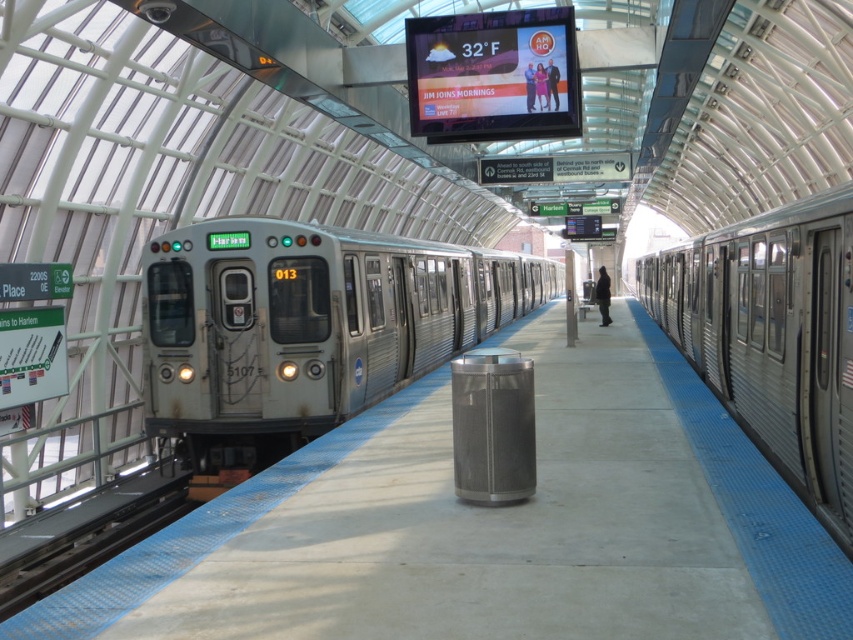
Question: Does rusty metal train at center have a lesser width compared to silver metallic train at right?

Choices:
 (A) yes
 (B) no

Answer: (B)

Question: Does rusty metal train at center have a larger size compared to silver metallic train at right?

Choices:
 (A) yes
 (B) no

Answer: (A)

Question: Which object is farther from the camera taking this photo?

Choices:
 (A) rusty metal train at center
 (B) silver metallic train at right

Answer: (A)

Question: Considering the relative positions of rusty metal train at center and silver metallic train at right in the image provided, where is rusty metal train at center located with respect to silver metallic train at right?

Choices:
 (A) below
 (B) above

Answer: (A)